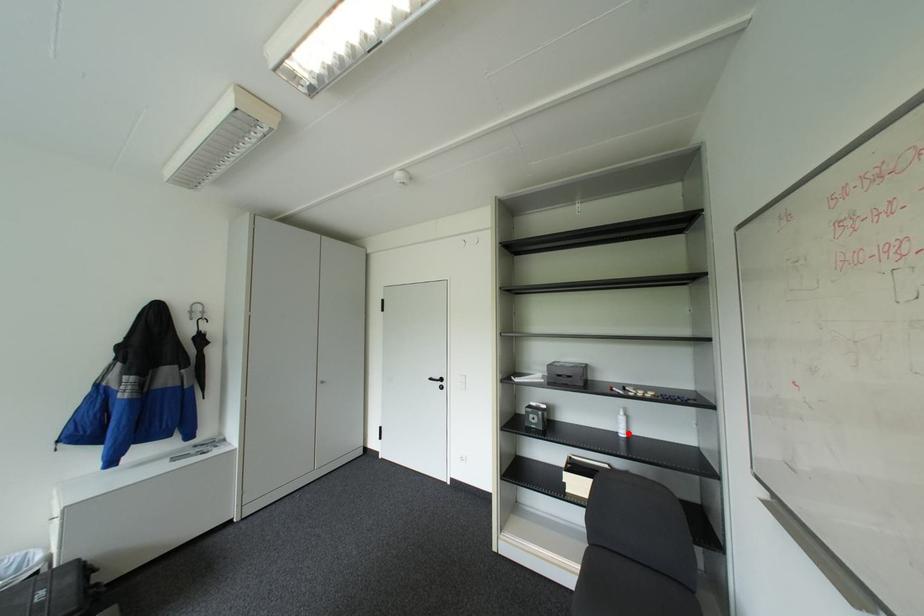
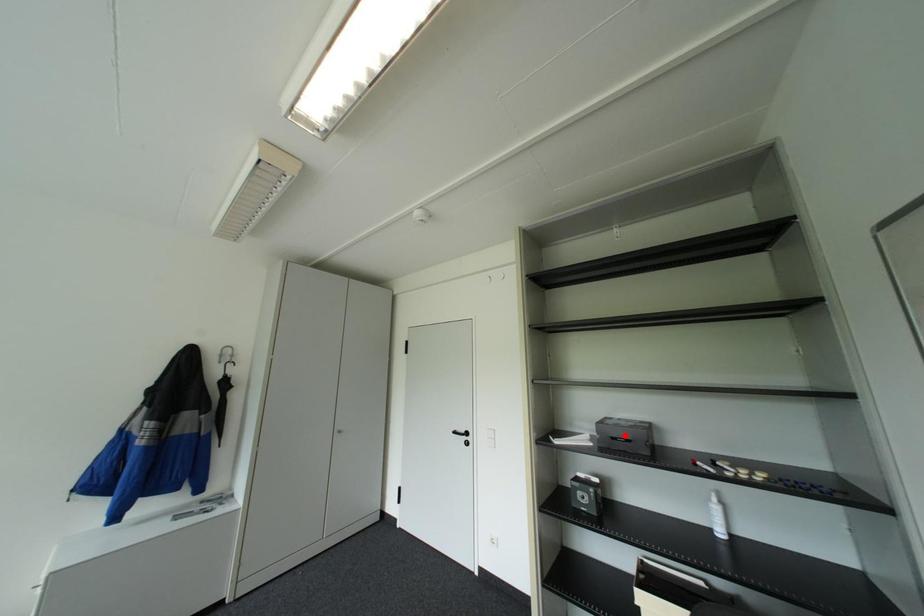
I am providing you with two images of the same scene from different viewpoints. A red point is marked on the first image and another point is marked on the second image. Does the point marked in image1 correspond to the same location as the one in image2?

No